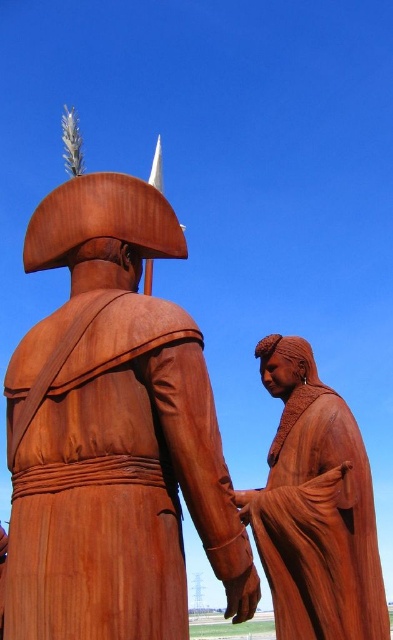
You are standing in front of the two statues and notice two specific points marked on them. The first point is at coordinates point (334, 580) and the second at point (238, 596). Which of these points is closer to you?

Point (334, 580) is closer to you because it is further to the viewer than point (238, 596).

You are standing in front of the two statues and want to take a photo of the point at coordinates point (62, 438). Is this point within the visible range of your camera which has a minimum focus distance of 30 meters?

The distance of point (62, 438) from the camera is 29.36 meters, which is less than the camera minimum focus distance of 30 meters. Therefore, the point is too close to be in focus.

You are a tour guide leading a group of visitors. You want to ensure everyone can comfortably see both the rusty wood statue at left and the rustic wood figure at center. If each visitor requires 1 meter of space to view each statue, what is the minimum distance you should keep the group from the statues?

The rusty wood statue at left is 18.16 meters from the rustic wood figure at center. To ensure each visitor has 1 meter of space to view both statues, the group should be positioned at least 18.16 meters away from the statues.